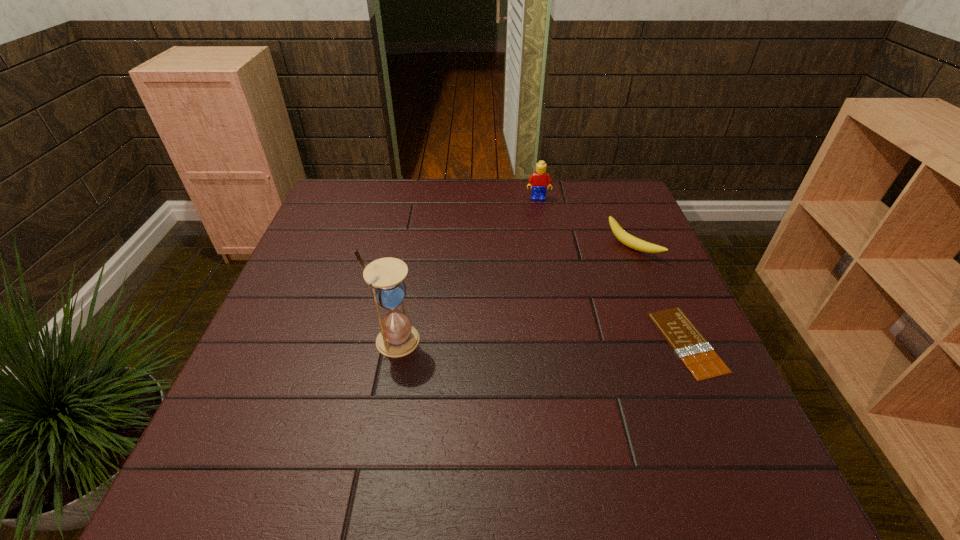
Where is `the leftmost object`? The image size is (960, 540). the leftmost object is located at coordinates (397, 338).

This screenshot has height=540, width=960. What are the coordinates of `the tallest object` in the screenshot? It's located at (397, 338).

Where is `the shortest object`? Image resolution: width=960 pixels, height=540 pixels. the shortest object is located at coordinates (689, 344).

At what (x,y) coordinates should I click in order to perform the action: click on the third shortest object. Please return your answer as a coordinate pair (x, y). This screenshot has width=960, height=540. Looking at the image, I should click on (539, 180).

Locate an element on the screen. the second object from left to right is located at coordinates (539, 180).

At what (x,y) coordinates should I click in order to perform the action: click on the second farthest object. Please return your answer as a coordinate pair (x, y). Image resolution: width=960 pixels, height=540 pixels. Looking at the image, I should click on (627, 239).

Where is `banana`? The image size is (960, 540). banana is located at coordinates (627, 239).

The height and width of the screenshot is (540, 960). What are the coordinates of `free space located on the right of the tallest object` in the screenshot? It's located at click(x=580, y=340).

Where is `free region located 0.180m on the back of the chocolate bar`? free region located 0.180m on the back of the chocolate bar is located at coordinates (650, 259).

At what (x,y) coordinates should I click in order to perform the action: click on vacant space located 0.150m on the front-facing side of the Lego. Please return your answer as a coordinate pair (x, y). Looking at the image, I should click on (540, 230).